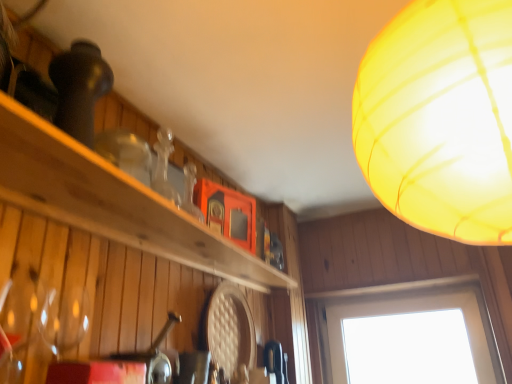
Describe the element at coordinates (440, 119) in the screenshot. I see `translucent yellow lampshade at upper right` at that location.

You are a GUI agent. You are given a task and a screenshot of the screen. Output one action in this format:
    pyautogui.click(x=<x>, y=<y>)
    Task: Click on the wooden shelf at upper left
    
    Given the screenshot: What is the action you would take?
    pyautogui.click(x=111, y=201)

Locate an element on the screen. transparent glass window at lower right is located at coordinates (408, 337).

At what (x,y) coordinates should I click in order to perform the action: click on translucent yellow lampshade at upper right. Please return your answer as a coordinate pair (x, y). The width and height of the screenshot is (512, 384). Looking at the image, I should click on (440, 119).

Is transparent glass window at lower right at the right side of wooden shelf at upper left?

Indeed, transparent glass window at lower right is positioned on the right side of wooden shelf at upper left.

Is transparent glass window at lower right oriented towards wooden shelf at upper left?

Yes.

Is transparent glass window at lower right inside the boundaries of wooden shelf at upper left, or outside?

The correct answer is: outside.

How many degrees apart are the facing directions of transparent glass window at lower right and wooden shelf at upper left?

The angle between the facing direction of transparent glass window at lower right and the facing direction of wooden shelf at upper left is 93.6 degrees.

From a real-world perspective, which object stands above the other?

translucent yellow lampshade at upper right.

In the scene shown: Are wooden shelf at upper left and translucent yellow lampshade at upper right far apart?

No.

Can you tell me how much wooden shelf at upper left and translucent yellow lampshade at upper right differ in facing direction?

94.2 degrees separate the facing orientations of wooden shelf at upper left and translucent yellow lampshade at upper right.

From the image's perspective, is translucent yellow lampshade at upper right located above or below transparent glass window at lower right?

Based on their image positions, translucent yellow lampshade at upper right is located above transparent glass window at lower right.

Is translucent yellow lampshade at upper right thinner than transparent glass window at lower right?

Incorrect, the width of translucent yellow lampshade at upper right is not less than that of transparent glass window at lower right.

Considering the positions of point (375, 66) and point (385, 290), is point (375, 66) closer or farther from the camera than point (385, 290)?

Point (375, 66) appears to be closer to the viewer than point (385, 290).

From their relative heights in the image, would you say translucent yellow lampshade at upper right is taller or shorter than transparent glass window at lower right?

In the image, translucent yellow lampshade at upper right appears to be taller than transparent glass window at lower right.

From the picture: Between translucent yellow lampshade at upper right and wooden shelf at upper left, which one appears on the right side from the viewer's perspective?

Positioned to the right is translucent yellow lampshade at upper right.

Is translucent yellow lampshade at upper right positioned behind wooden shelf at upper left?

No, it is in front of wooden shelf at upper left.

Is translucent yellow lampshade at upper right looking in the opposite direction of wooden shelf at upper left?

translucent yellow lampshade at upper right is not turned away from wooden shelf at upper left.

How many degrees apart are the facing directions of translucent yellow lampshade at upper right and wooden shelf at upper left?

94.2 degrees separate the facing orientations of translucent yellow lampshade at upper right and wooden shelf at upper left.

Considering the positions of objects transparent glass window at lower right and translucent yellow lampshade at upper right in the image provided, who is in front, transparent glass window at lower right or translucent yellow lampshade at upper right?

translucent yellow lampshade at upper right is in front.

Is transparent glass window at lower right situated inside translucent yellow lampshade at upper right or outside?

transparent glass window at lower right is outside translucent yellow lampshade at upper right.

Which of these two, transparent glass window at lower right or translucent yellow lampshade at upper right, is thinner?

transparent glass window at lower right is thinner.

Is transparent glass window at lower right next to translucent yellow lampshade at upper right?

transparent glass window at lower right and translucent yellow lampshade at upper right are clearly separated.

Considering the sizes of wooden shelf at upper left and transparent glass window at lower right in the image, is wooden shelf at upper left wider or thinner than transparent glass window at lower right?

wooden shelf at upper left is wider than transparent glass window at lower right.

Does point (38, 210) come in front of point (458, 340)?

Yes, point (38, 210) is closer to viewer.

Is wooden shelf at upper left to the left of transparent glass window at lower right from the viewer's perspective?

Yes, wooden shelf at upper left is to the left of transparent glass window at lower right.

Which object is more forward, wooden shelf at upper left or transparent glass window at lower right?

wooden shelf at upper left is more forward.

You are a GUI agent. You are given a task and a screenshot of the screen. Output one action in this format:
    pyautogui.click(x=<x>, y=<y>)
    Task: Click on the window below the wooden shelf at upper left (from the image's perspective)
    This screenshot has height=384, width=512.
    Given the screenshot: What is the action you would take?
    pyautogui.click(x=408, y=337)

The image size is (512, 384). There is a wooden shelf at upper left. Find the location of `lamp above it (from a real-world perspective)`. lamp above it (from a real-world perspective) is located at coordinates (440, 119).

Considering their positions, is translucent yellow lampshade at upper right positioned further to wooden shelf at upper left than transparent glass window at lower right?

Based on the image, transparent glass window at lower right appears to be further to wooden shelf at upper left.

Looking at the image, which one is located closer to translucent yellow lampshade at upper right, wooden shelf at upper left or transparent glass window at lower right?

wooden shelf at upper left lies closer to translucent yellow lampshade at upper right than the other object.

When comparing their distances from transparent glass window at lower right, does wooden shelf at upper left or translucent yellow lampshade at upper right seem further?

translucent yellow lampshade at upper right lies further to transparent glass window at lower right than the other object.

Which object lies nearer to the anchor point wooden shelf at upper left, transparent glass window at lower right or translucent yellow lampshade at upper right?

Based on the image, translucent yellow lampshade at upper right appears to be nearer to wooden shelf at upper left.

Considering their positions, is translucent yellow lampshade at upper right positioned further to transparent glass window at lower right than wooden shelf at upper left?

The object further to transparent glass window at lower right is translucent yellow lampshade at upper right.

Looking at the image, which one is located closer to translucent yellow lampshade at upper right, transparent glass window at lower right or wooden shelf at upper left?

Based on the image, wooden shelf at upper left appears to be nearer to translucent yellow lampshade at upper right.

This screenshot has height=384, width=512. I want to click on shelf between translucent yellow lampshade at upper right and transparent glass window at lower right along the z-axis, so click(x=111, y=201).